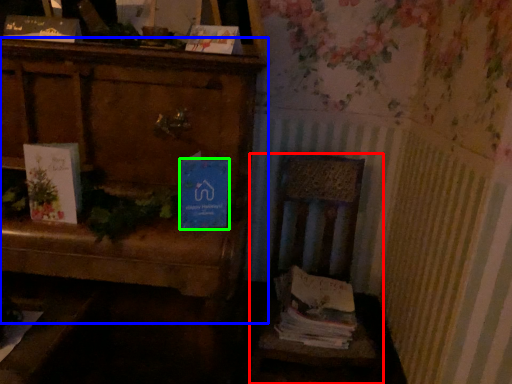
Question: Which is farther away from chair (highlighted by a red box)? furniture (highlighted by a blue box) or paperback book (highlighted by a green box)?

Choices:
 (A) furniture
 (B) paperback book

Answer: (B)